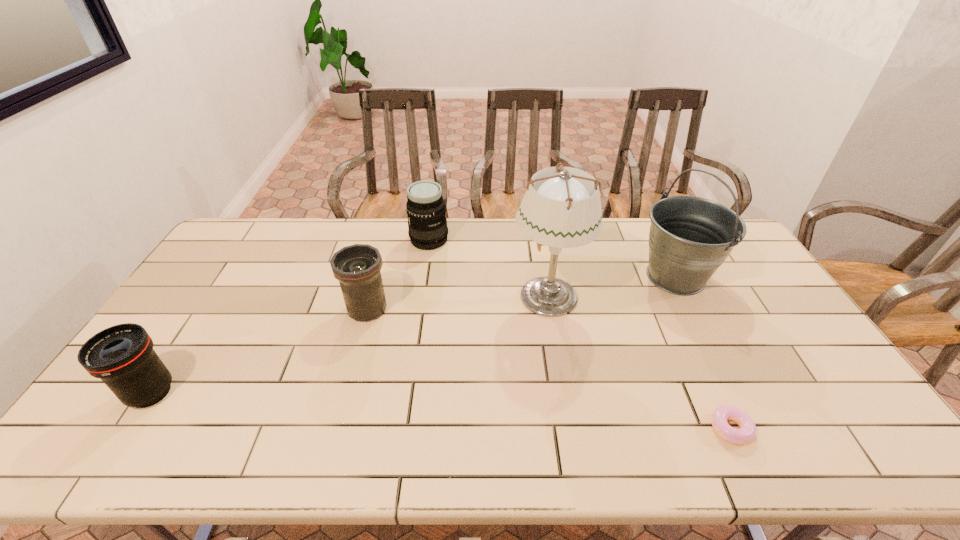
I want to click on the third object from right to left, so click(x=562, y=209).

Identify the location of bucket. This screenshot has width=960, height=540. (690, 237).

Where is `the farthest telephoto lens`? The image size is (960, 540). the farthest telephoto lens is located at coordinates (426, 211).

Locate an element on the screen. The height and width of the screenshot is (540, 960). the fourth object from right to left is located at coordinates [426, 211].

The height and width of the screenshot is (540, 960). What are the coordinates of `the second telephoto lens from left to right` in the screenshot? It's located at (357, 267).

The width and height of the screenshot is (960, 540). Identify the location of the second nearest telephoto lens. (357, 267).

Find the location of `the leftmost object`. the leftmost object is located at coordinates (122, 356).

Locate an element on the screen. the nearest telephoto lens is located at coordinates (122, 356).

You are a GUI agent. You are given a task and a screenshot of the screen. Output one action in this format:
    pyautogui.click(x=<x>, y=<y>)
    Task: Click on the shortest object
    This screenshot has height=540, width=960.
    Given the screenshot: What is the action you would take?
    pyautogui.click(x=747, y=431)

Where is `free spot located on the lampshade of the lampshade`? free spot located on the lampshade of the lampshade is located at coordinates (429, 295).